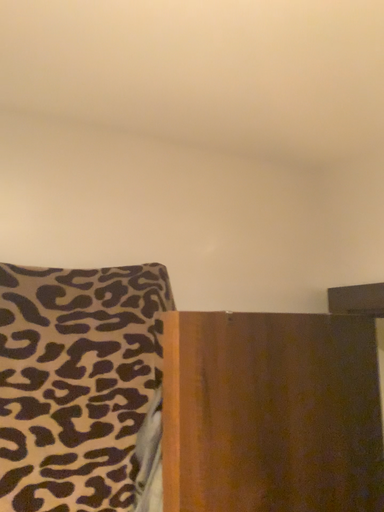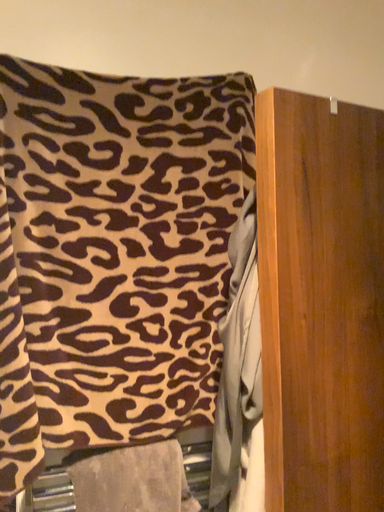
Question: Which way did the camera rotate in the video?

Choices:
 (A) rotated upward
 (B) rotated downward

Answer: (B)